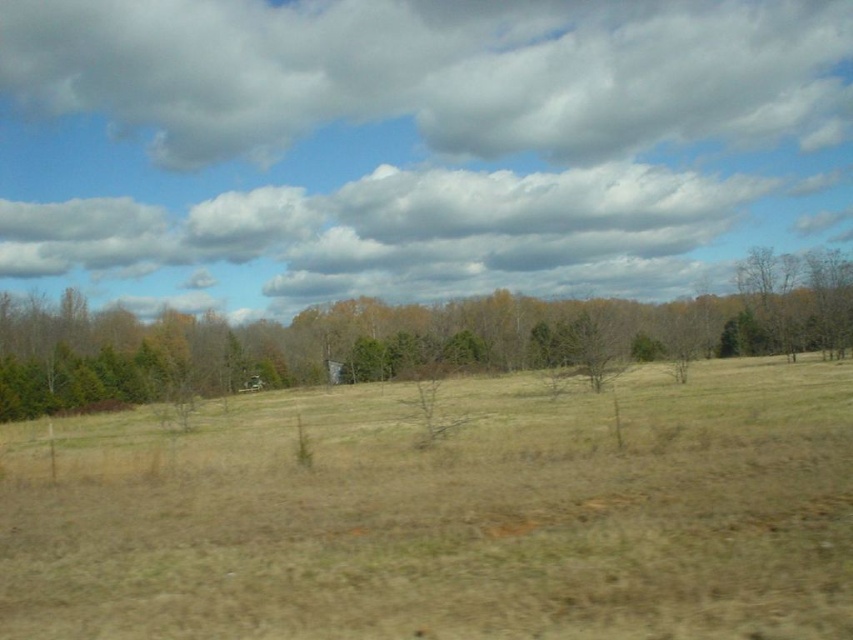
You are sitting in a car with a transparent glass car window at center. Looking outside, you notice a cloudy sky at upper center. Which one has a greater width from your perspective?

The cloudy sky at upper center has a greater width than the transparent glass car window at center according to the description.

You are a bird flying over a rural landscape. You notice the brown dry grass at center and the cloudy sky at upper center. Which object appears larger from your perspective?

The cloudy sky at upper center appears larger because it is farther away than the brown dry grass at center, making it seem bigger in the sky.